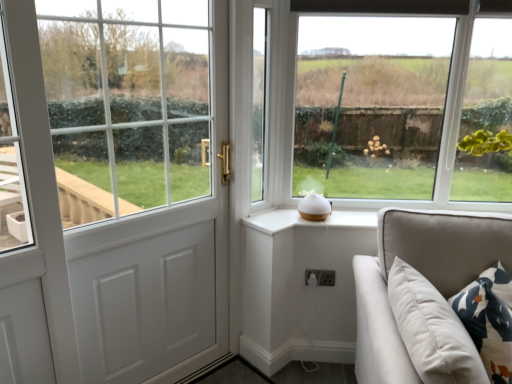
Question: Is green leafy plant at upper right, which appears as the third window when viewed from the left, oriented towards white plastic electric outlet at lower center?

Choices:
 (A) no
 (B) yes

Answer: (A)

Question: Is white plastic electric outlet at lower center completely or partially inside green leafy plant at upper right, which appears as the third window when viewed from the left?

Choices:
 (A) no
 (B) yes

Answer: (A)

Question: Considering the relative sizes of green leafy plant at upper right, the first window when ordered from right to left, and white plastic electric outlet at lower center in the image provided, is green leafy plant at upper right, the first window when ordered from right to left, thinner than white plastic electric outlet at lower center?

Choices:
 (A) yes
 (B) no

Answer: (B)

Question: Can you confirm if green leafy plant at upper right, which appears as the third window when viewed from the left, is positioned to the right of white plastic electric outlet at lower center?

Choices:
 (A) no
 (B) yes

Answer: (B)

Question: Does green leafy plant at upper right, the first window when ordered from right to left, lie behind white plastic electric outlet at lower center?

Choices:
 (A) no
 (B) yes

Answer: (A)

Question: Is green leafy plant at upper right, which appears as the third window when viewed from the left, smaller than white plastic electric outlet at lower center?

Choices:
 (A) no
 (B) yes

Answer: (A)

Question: Considering the relative positions of white plastic electric outlet at lower center and white glass window at center, which is the 2th window from right to left, in the image provided, is white plastic electric outlet at lower center in front of white glass window at center, which is the 2th window from right to left,?

Choices:
 (A) yes
 (B) no

Answer: (B)

Question: From a real-world perspective, is white plastic electric outlet at lower center located beneath white glass window at center, the 2th window viewed from the left?

Choices:
 (A) no
 (B) yes

Answer: (B)

Question: Considering the relative sizes of white plastic electric outlet at lower center and white glass window at center, which is the 2th window from right to left, in the image provided, is white plastic electric outlet at lower center bigger than white glass window at center, which is the 2th window from right to left,?

Choices:
 (A) yes
 (B) no

Answer: (B)

Question: Is white plastic electric outlet at lower center facing towards white glass window at center, the 2th window viewed from the left?

Choices:
 (A) yes
 (B) no

Answer: (B)

Question: Is the surface of white plastic electric outlet at lower center in direct contact with white glass window at center, which is the 2th window from right to left?

Choices:
 (A) yes
 (B) no

Answer: (B)

Question: Is the depth of white plastic electric outlet at lower center greater than that of white glass window at center, the 2th window viewed from the left?

Choices:
 (A) yes
 (B) no

Answer: (A)

Question: From a real-world perspective, is white glass door at left, the third window when ordered from right to left, positioned over white plastic electric outlet at lower center based on gravity?

Choices:
 (A) no
 (B) yes

Answer: (B)